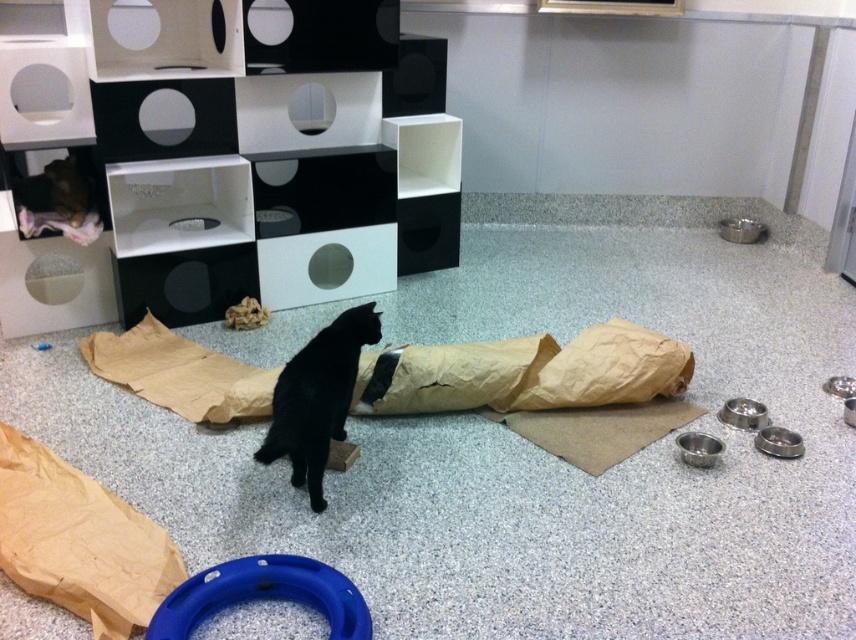
Is brown crinkled paper bag at lower left taller than blue rubber ring at lower center?

Yes.

Who is lower down, brown crinkled paper bag at lower left or blue rubber ring at lower center?

Positioned lower is blue rubber ring at lower center.

Where is `brown crinkled paper bag at lower left`? This screenshot has width=856, height=640. brown crinkled paper bag at lower left is located at coordinates (79, 541).

Find the location of a particular element. The height and width of the screenshot is (640, 856). brown crinkled paper bag at lower left is located at coordinates (79, 541).

Is brown crinkled paper bag at center smaller than black matte fur cat at center?

Correct, brown crinkled paper bag at center occupies less space than black matte fur cat at center.

Which is behind, point (619, 324) or point (333, 404)?

Point (619, 324)

Find the location of a particular element. The height and width of the screenshot is (640, 856). brown crinkled paper bag at center is located at coordinates (602, 369).

Who is higher up, brown crinkled paper bag at lower left or black matte fur cat at center?

black matte fur cat at center is higher up.

Is brown crinkled paper bag at lower left shorter than black matte fur cat at center?

Indeed, brown crinkled paper bag at lower left has a lesser height compared to black matte fur cat at center.

This screenshot has height=640, width=856. In order to click on brown crinkled paper bag at lower left in this screenshot , I will do click(79, 541).

Locate an element on the screen. brown crinkled paper bag at lower left is located at coordinates (79, 541).